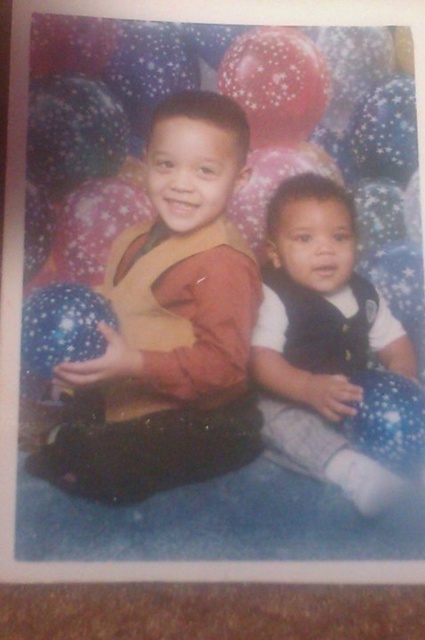
Question: Does matte yellow vest at center appear on the left side of white soft vest at center?

Choices:
 (A) no
 (B) yes

Answer: (B)

Question: From the image, what is the correct spatial relationship of matte yellow vest at center in relation to white soft vest at center?

Choices:
 (A) right
 (B) left

Answer: (B)

Question: Which object appears closest to the camera in this image?

Choices:
 (A) white soft vest at center
 (B) matte yellow vest at center

Answer: (B)

Question: Does matte yellow vest at center have a smaller size compared to white soft vest at center?

Choices:
 (A) no
 (B) yes

Answer: (A)